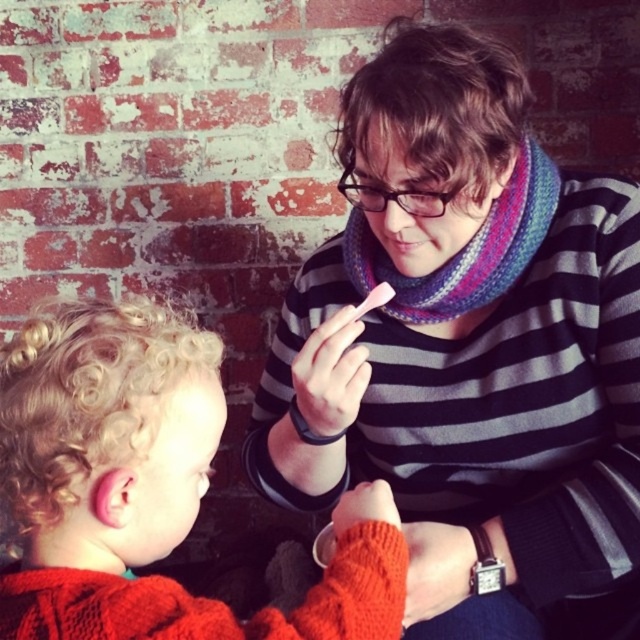
You are a fashion designer who needs to decide which sweater to feature in a catalog. The catalog requires the larger sweater to be placed on the mannequin. Which sweater should you choose between the striped sweater at center and the cabled knit sweater at lower left?

The striped sweater at center is bigger than the cabled knit sweater at lower left, so you should choose the striped sweater at center for the mannequin.

You are trying to decide which sweater to take for a casual day out. Both the striped sweater at center and the cabled knit sweater at lower left are options. Based on their sizes, which one would be more comfortable if you prefer a looser fit?

The striped sweater at center has a larger width than the cabled knit sweater at lower left, so it would be more comfortable for a looser fit.

You are organizing a clothing donation drive and need to stack the striped sweater at center and the cabled knit sweater at lower left vertically. According to the image, which sweater should be placed on top to match their arrangement in the picture?

The striped sweater at center should be placed on top of the cabled knit sweater at lower left because the striped sweater at center is above the cabled knit sweater at lower left in the image.